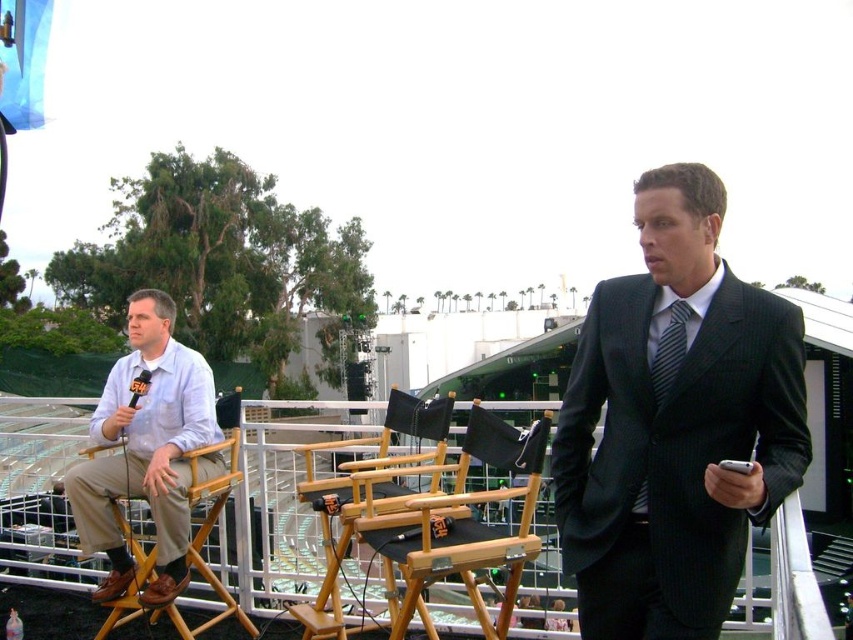
Question: Can you confirm if light blue cotton shirt at left is thinner than dark gray striped tie at center?

Choices:
 (A) yes
 (B) no

Answer: (B)

Question: Is dark gray pinstripe suit at center below wooden director's chair at center?

Choices:
 (A) yes
 (B) no

Answer: (B)

Question: Considering the real-world distances, which object is closest to the wooden director's chair at center?

Choices:
 (A) light blue cotton shirt at left
 (B) dark gray striped tie at center

Answer: (A)

Question: Which of the following is the closest to the observer?

Choices:
 (A) light blue cotton shirt at left
 (B) wooden director's chair at left
 (C) dark gray striped tie at center
 (D) wooden director's chair at center

Answer: (C)

Question: Considering the relative positions of wooden director's chair at center and wooden director's chair at left in the image provided, where is wooden director's chair at center located with respect to wooden director's chair at left?

Choices:
 (A) above
 (B) below

Answer: (B)

Question: Which is nearer to the dark gray pinstripe suit at center?

Choices:
 (A) wooden director's chair at center
 (B) wooden director's chair at left
 (C) light blue cotton shirt at left
 (D) dark gray striped tie at center

Answer: (D)